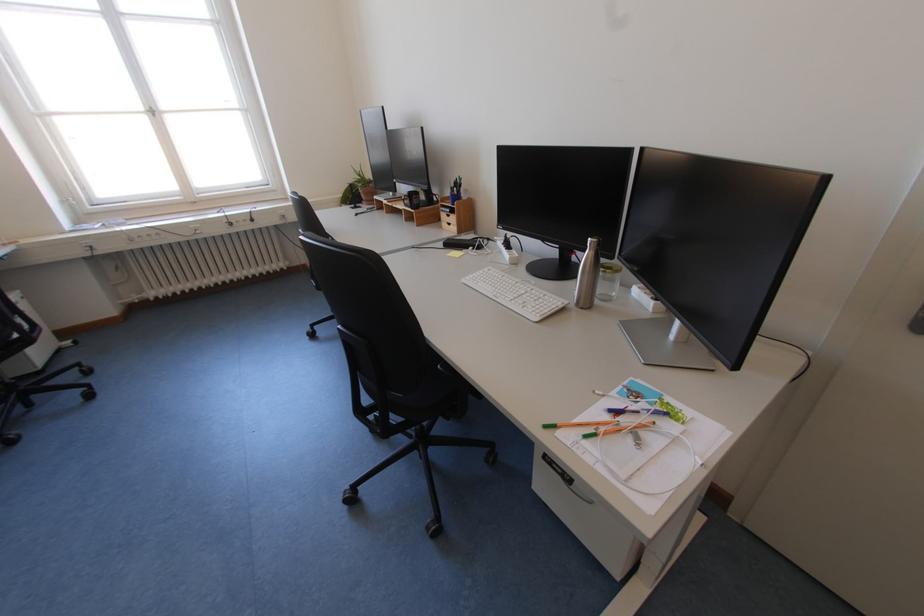
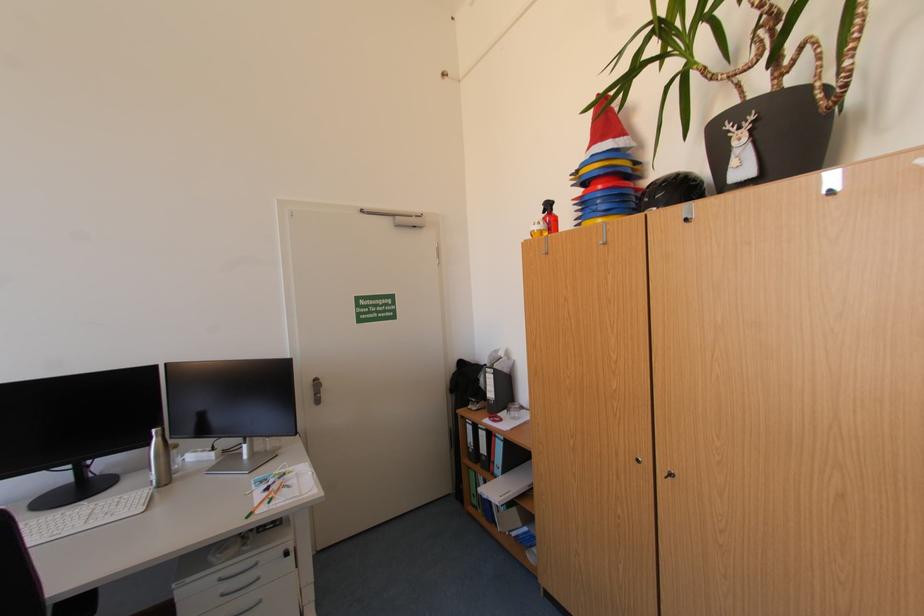
In the second image, find the point that corresponds to (599,240) in the first image.

(161, 431)